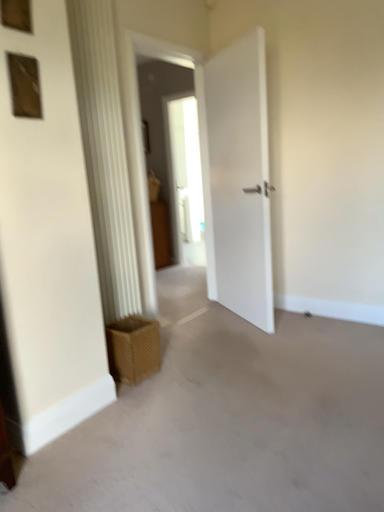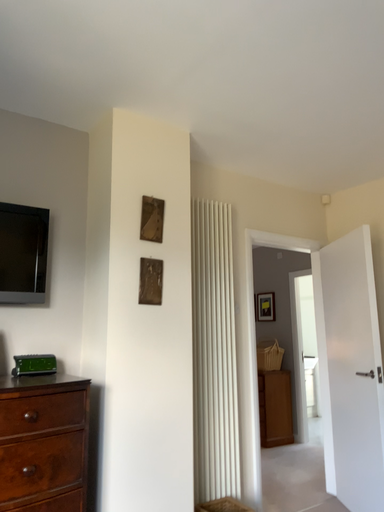
Question: How did the camera likely rotate when shooting the video?

Choices:
 (A) rotated upward
 (B) rotated downward

Answer: (A)